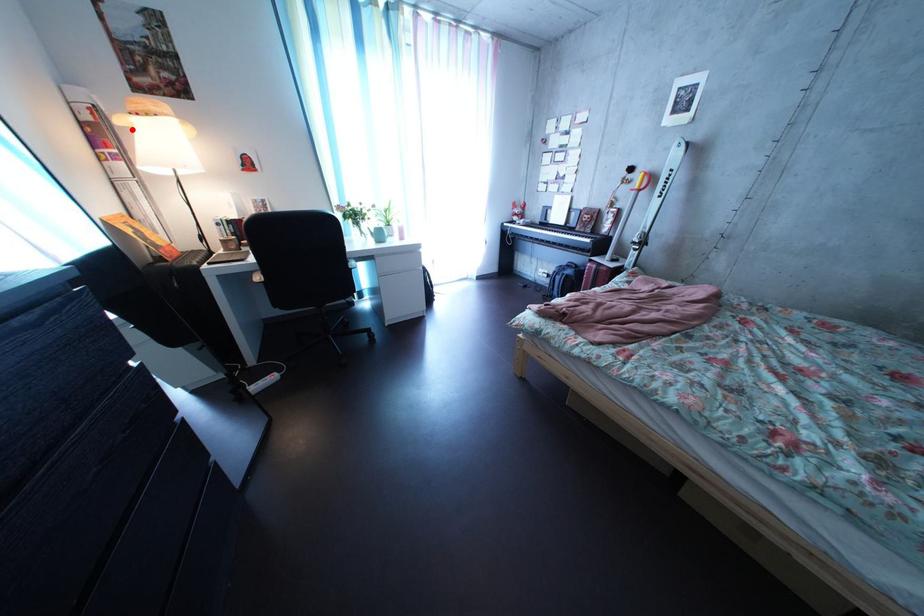
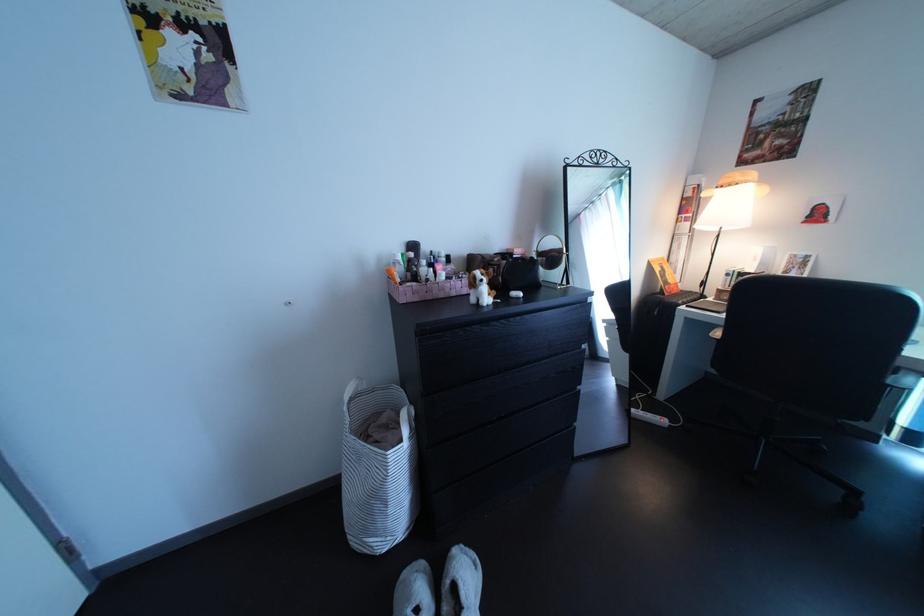
Where in the second image is the point corresponding to the highlighted location from the first image?

(719, 203)